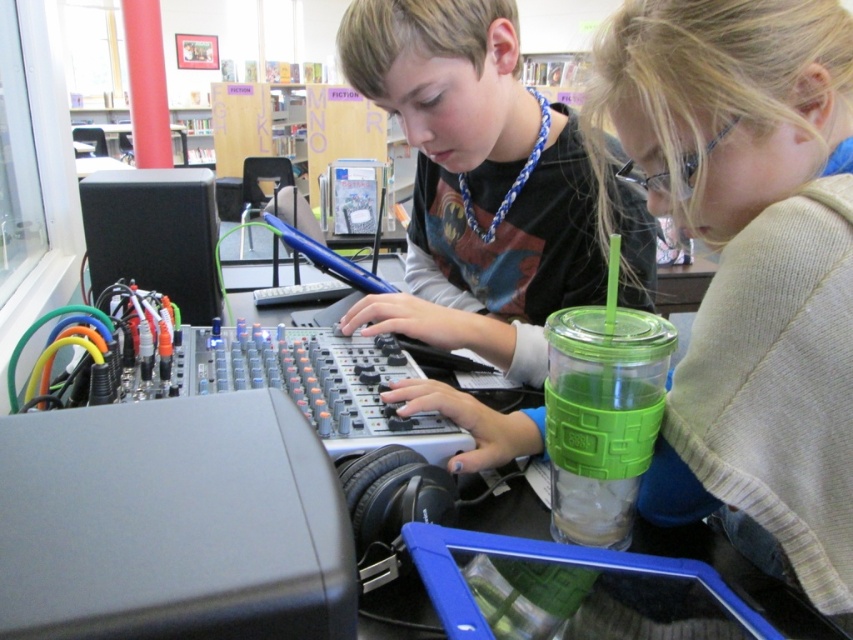
You are a researcher analyzing the spatial arrangement of items in the image. The green plastic cup at center is located at coordinates 0.411, 0.880. What does this coordinate system imply about the cup?

The coordinates indicate that the green plastic cup at center is positioned at 41.1 percent from the left edge and 88.0 percent from the top edge of the image.

You are a librarian trying to locate two specific points in the library. The first point is at coordinates point (x=844, y=51) and the second is at point (x=386, y=298). According to the scene, which point is closer to the observer?

Point (x=844, y=51) is in front of point (x=386, y=298), so it is closer to the observer.